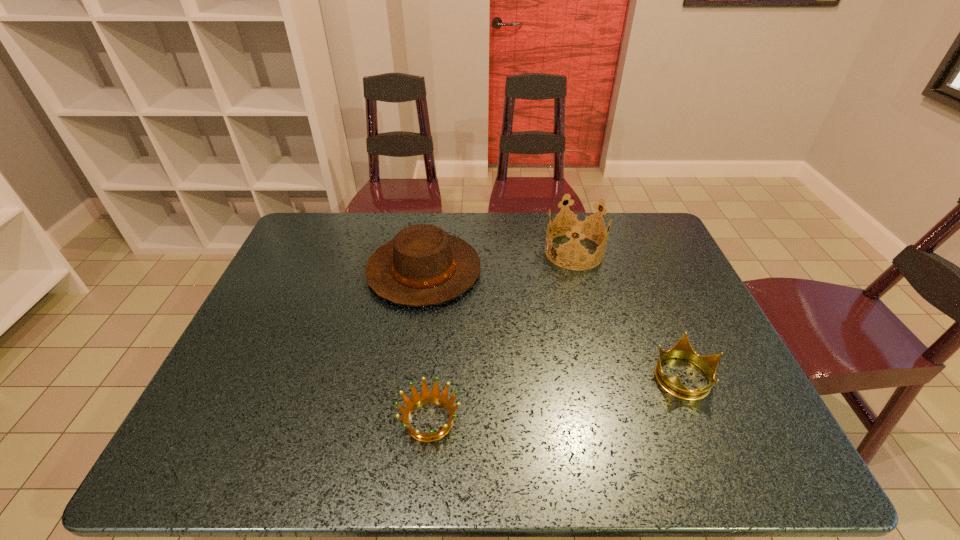
Identify the location of the tallest crown. This screenshot has width=960, height=540. (578, 226).

Locate an element on the screen. Image resolution: width=960 pixels, height=540 pixels. the third object from left to right is located at coordinates (578, 226).

You are a GUI agent. You are given a task and a screenshot of the screen. Output one action in this format:
    pyautogui.click(x=<x>, y=<y>)
    Task: Click on the cowboy hat
    
    Given the screenshot: What is the action you would take?
    pyautogui.click(x=422, y=266)

I want to click on the rightmost crown, so click(x=682, y=349).

I want to click on the rightmost object, so click(682, 349).

Where is `the shortest crown`? Image resolution: width=960 pixels, height=540 pixels. the shortest crown is located at coordinates (426, 397).

Image resolution: width=960 pixels, height=540 pixels. I want to click on the leftmost crown, so click(x=426, y=397).

In order to click on free space located on the front of the second object from right to left in this screenshot , I will do `click(593, 327)`.

Where is `vacant position located on the back of the third shortest object`? The height and width of the screenshot is (540, 960). vacant position located on the back of the third shortest object is located at coordinates (433, 213).

Image resolution: width=960 pixels, height=540 pixels. Find the location of `vacant area situated 0.230m on the left of the rightmost crown`. vacant area situated 0.230m on the left of the rightmost crown is located at coordinates (556, 376).